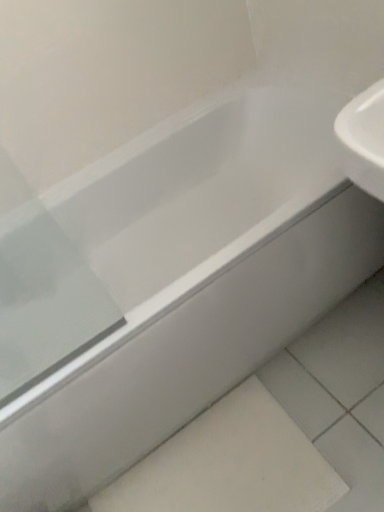
Where is `vacant space to the right of white matte ceramic tile at lower center`? Image resolution: width=384 pixels, height=512 pixels. vacant space to the right of white matte ceramic tile at lower center is located at coordinates (334, 388).